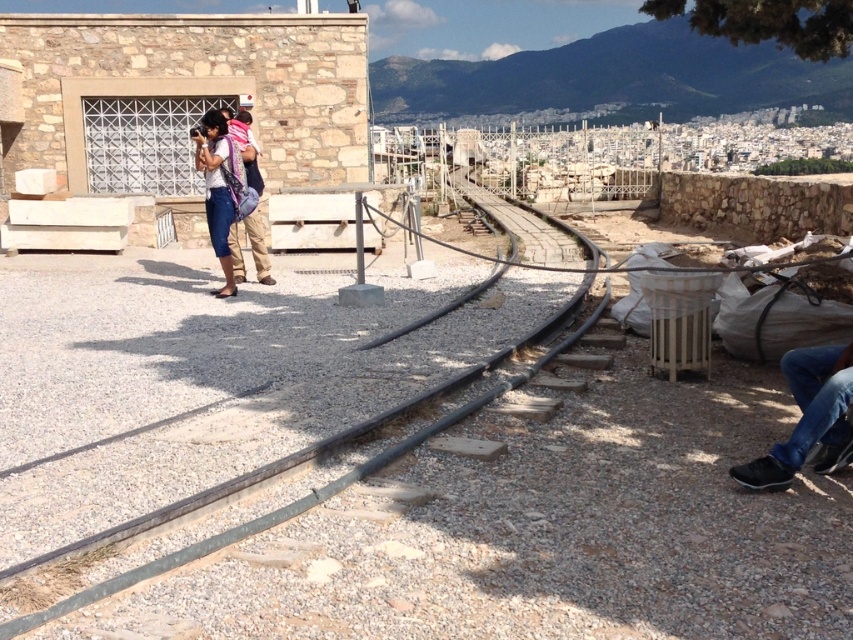
You are a photographer standing at the center of the railway tracks. You notice black leather shoes at lower right in the scene. Based on their coordinates, where exactly are the black leather shoes located relative to your position?

The black leather shoes at lower right are located at coordinates point (808, 417), which places them to the right and slightly below your current position at the center of the railway tracks.

You are standing at the point labeled point (65, 609) and want to walk to the point labeled point (814, 349). Based on the scene description, which direction should you head?

You should head away from the viewer since point (814, 349) is further away than point (65, 609).